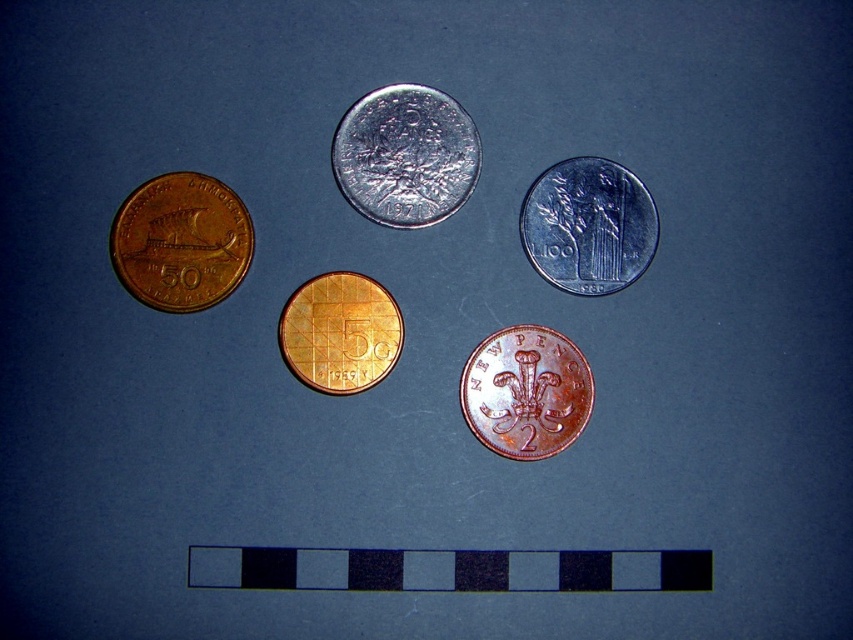
Question: Which is nearer to the matte gold coin at left?

Choices:
 (A) copper-bronze new pence at center
 (B) satin silver coin at upper right

Answer: (A)

Question: Is shiny silver coin at center above matte gold coin at left?

Choices:
 (A) no
 (B) yes

Answer: (B)

Question: Can you confirm if shiny silver coin at center is positioned to the left of matte gold coin at left?

Choices:
 (A) yes
 (B) no

Answer: (B)

Question: Based on their relative distances, which object is farther from the matte gold coin at left?

Choices:
 (A) shiny silver coin at center
 (B) satin silver coin at upper right
 (C) copper-bronze new pence at center
 (D) gold-plated coin at center

Answer: (B)

Question: Which object is the farthest from the satin silver coin at upper right?

Choices:
 (A) matte gold coin at left
 (B) shiny silver coin at center
 (C) gold-plated coin at center
 (D) copper-bronze new pence at center

Answer: (A)

Question: Can you confirm if matte gold coin at left is smaller than copper-bronze new pence at center?

Choices:
 (A) yes
 (B) no

Answer: (B)